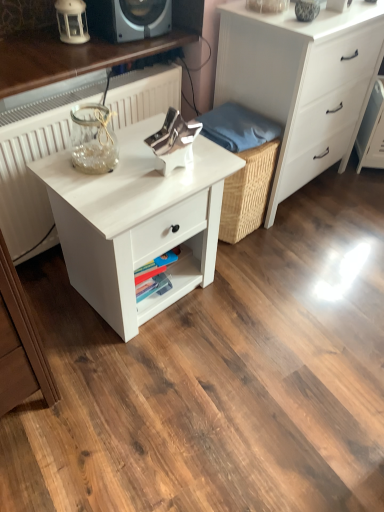
At what (x,y) coordinates should I click in order to perform the action: click on space that is in front of white matte lantern at upper left. Please return your answer as a coordinate pair (x, y). Looking at the image, I should click on (38, 54).